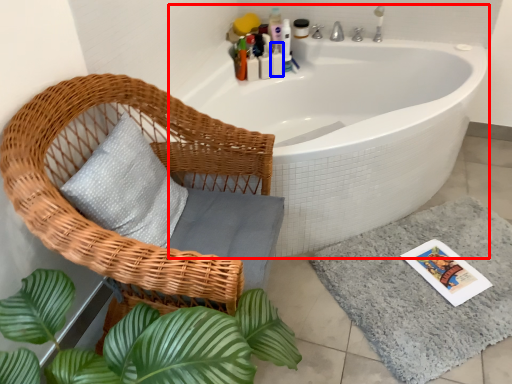
Question: Which object is further to the camera taking this photo, bathtub (highlighted by a red box) or toiletry (highlighted by a blue box)?

Choices:
 (A) bathtub
 (B) toiletry

Answer: (B)